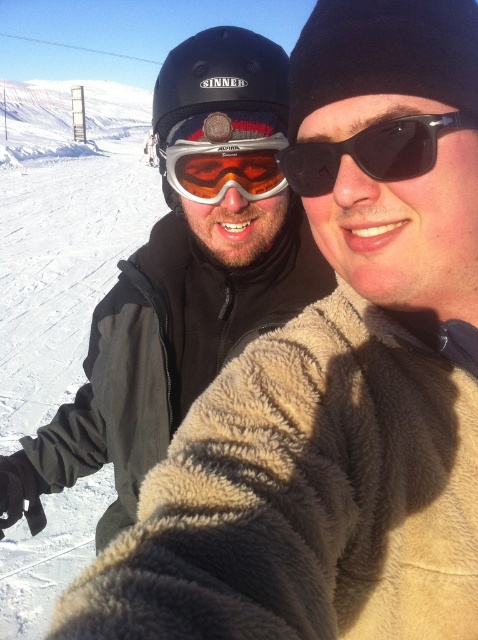
Does matte black helmet at upper left appear on the left side of matte orange ski goggles at center?

Indeed, matte black helmet at upper left is positioned on the left side of matte orange ski goggles at center.

Which is in front, point (94, 339) or point (187, 196)?

Point (187, 196) is more forward.

At what (x,y) coordinates should I click in order to perform the action: click on matte black helmet at upper left. Please return your answer as a coordinate pair (x, y). The height and width of the screenshot is (640, 478). Looking at the image, I should click on (183, 276).

Can you confirm if matte black helmet at upper left is wider than matte black goggles at upper center?

Yes.

Does point (139, 282) come behind point (276, 156)?

Yes, point (139, 282) is behind point (276, 156).

Where is `matte black helmet at upper left`? matte black helmet at upper left is located at coordinates (183, 276).

You are a GUI agent. You are given a task and a screenshot of the screen. Output one action in this format:
    pyautogui.click(x=<x>, y=<y>)
    Task: Click on the matte black goggles at upper center
    This screenshot has width=478, height=640.
    Given the screenshot: What is the action you would take?
    pyautogui.click(x=370, y=150)

Is point (308, 145) in front of point (217, 173)?

Yes.

Identify the location of matte black goggles at upper center. (370, 150).